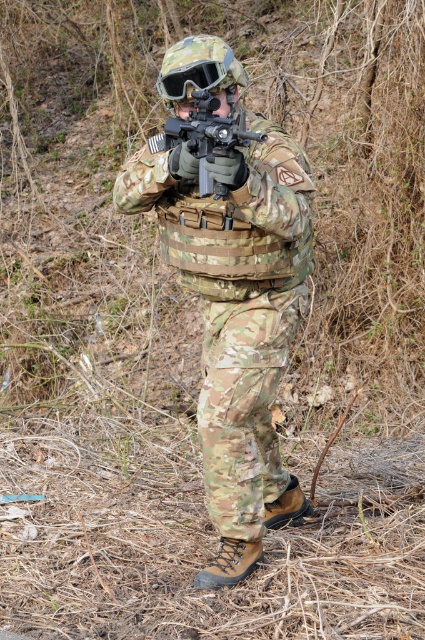
Based on the photo, you are a military trainer observing a soldier in a training exercise. You notice a point marked at coordinates (206, 138) on their equipment. What object is located at that specific coordinate?

The point at coordinates (206, 138) indicates the matte black rifle at center.

Based on the photo, you are a field analyst trying to locate the matte black rifle at center in a satellite image. The coordinates provided are in a normalized format where the top left corner is the origin point. Can you determine the quadrant where the rifle is located?

The matte black rifle at center is located at point [206,138]. In a normalized coordinate system, the first value represents the horizontal axis and the second the vertical. Since both coordinates are less than 0.5, the rifle is in the lower left quadrant.